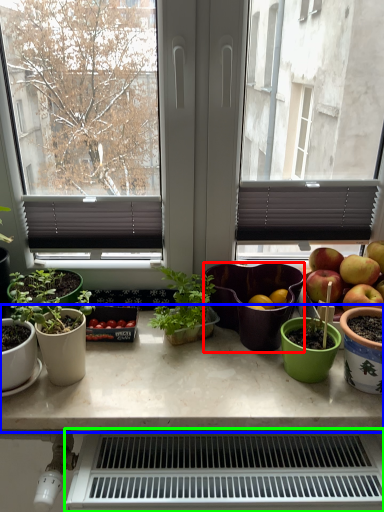
Question: Considering the real-world distances, which object is closest to salad bowl (highlighted by a red box)? table (highlighted by a blue box) or appliance (highlighted by a green box).

Choices:
 (A) table
 (B) appliance

Answer: (A)